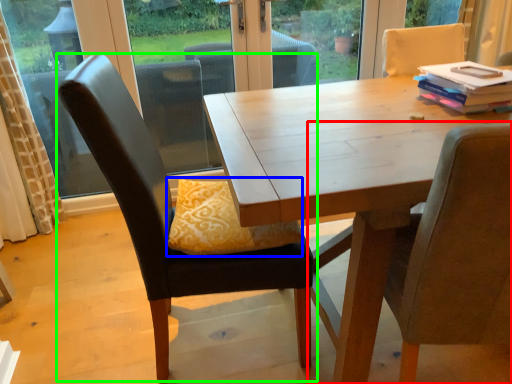
Question: Which object is the farthest from chair (highlighted by a red box)? Choose among these: pillow (highlighted by a blue box) or chair (highlighted by a green box).

Choices:
 (A) pillow
 (B) chair

Answer: (B)